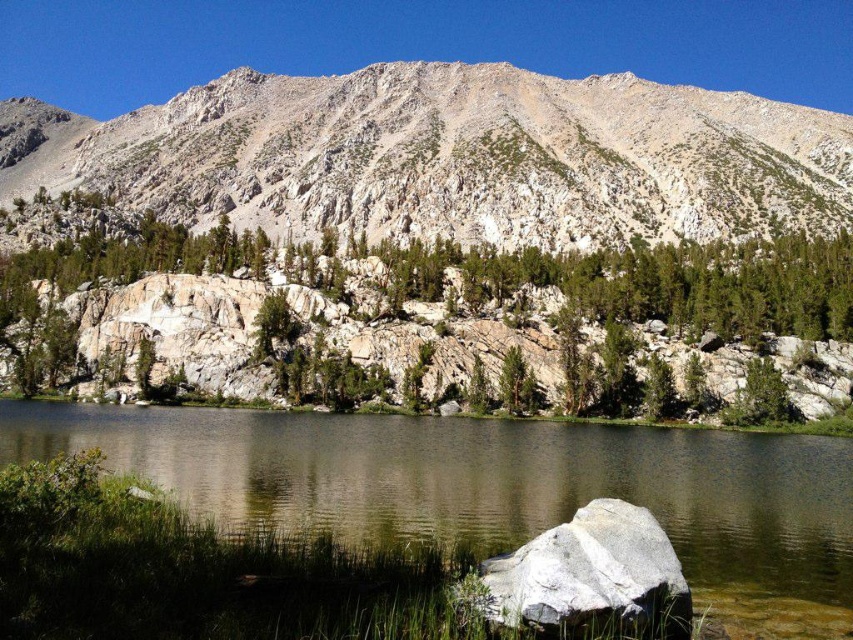
You are an explorer trying to determine the best vantage point to view the rugged stone mountain at upper center and the green textured rock at upper center. Which object would require you to stand further back to fully see its entire form?

The rugged stone mountain at upper center is larger in size than the green textured rock at upper center, so you would need to stand further back to fully see the rugged stone mountain at upper center.

You are standing at the point marked by the white rock partially submerged near the shore. Looking towards the rugged stone mountain at upper center, which is represented by the point at coordinates point (451, 156), what direction should you head to reach it?

You should head north because the rugged stone mountain at upper center is located north of the white rock partially submerged near the shore.